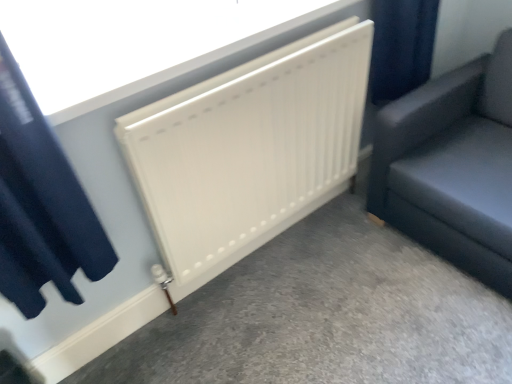
The width and height of the screenshot is (512, 384). What do you see at coordinates (249, 149) in the screenshot? I see `white matte radiator at center` at bounding box center [249, 149].

Where is `dark blue velvet curtain at upper left`? The height and width of the screenshot is (384, 512). dark blue velvet curtain at upper left is located at coordinates (41, 204).

Identify the location of matte black sofa at right. (452, 166).

From the image's perspective, which one is positioned higher, dark blue velvet curtain at upper left or white matte radiator at center?

white matte radiator at center, from the image's perspective.

Locate an element on the screen. The height and width of the screenshot is (384, 512). radiator behind the dark blue velvet curtain at upper left is located at coordinates (249, 149).

Which is behind, dark blue velvet curtain at upper left or white matte radiator at center?

white matte radiator at center.

From a real-world perspective, between dark blue velvet curtain at upper left and white matte radiator at center, who is vertically higher?

dark blue velvet curtain at upper left is physically above.

The width and height of the screenshot is (512, 384). Find the location of `furniture on the right of dark blue velvet curtain at upper left`. furniture on the right of dark blue velvet curtain at upper left is located at coordinates (452, 166).

Can you tell me how much dark blue velvet curtain at upper left and matte black sofa at right differ in facing direction?

There is a 90.7-degree angle between the facing directions of dark blue velvet curtain at upper left and matte black sofa at right.

Is dark blue velvet curtain at upper left oriented away from matte black sofa at right?

That's not correct — dark blue velvet curtain at upper left is not looking away from matte black sofa at right.

From the image's perspective, is dark blue velvet curtain at upper left on matte black sofa at right?

Incorrect, from the image's perspective, dark blue velvet curtain at upper left is lower than matte black sofa at right.

From a real-world perspective, is matte black sofa at right positioned under white matte radiator at center based on gravity?

Yes, from a real-world perspective, matte black sofa at right is under white matte radiator at center.

Is white matte radiator at center located within matte black sofa at right?

No, white matte radiator at center is located outside of matte black sofa at right.

What's the angular difference between matte black sofa at right and white matte radiator at center's facing directions?

matte black sofa at right and white matte radiator at center are facing 88.6 degrees away from each other.

Based on the photo, from the image's perspective, is matte black sofa at right on top of white matte radiator at center?

Yes, from the image's perspective, matte black sofa at right is over white matte radiator at center.

Is white matte radiator at center facing towards matte black sofa at right?

No, white matte radiator at center does not turn towards matte black sofa at right.

Can you tell me how much white matte radiator at center and matte black sofa at right differ in facing direction?

The angular difference between white matte radiator at center and matte black sofa at right is 90 degrees.

From the image's perspective, is white matte radiator at center above or below matte black sofa at right?

Based on their image positions, white matte radiator at center is located beneath matte black sofa at right.

Which is more distant, (324, 223) or (498, 126)?

The point (324, 223) is farther from the camera.

Would you consider matte black sofa at right to be distant from white matte radiator at center?

No, there isn't a large distance between matte black sofa at right and white matte radiator at center.

Locate an element on the screen. furniture located underneath the white matte radiator at center (from a real-world perspective) is located at coordinates (452, 166).

Does point (489, 273) come closer to viewer compared to point (41, 46)?

No.

In terms of size, does dark blue velvet curtain at upper left appear bigger or smaller than white matte radiator at center?

In the image, dark blue velvet curtain at upper left appears to be larger than white matte radiator at center.

Would you say dark blue velvet curtain at upper left is outside white matte radiator at center?

That's correct, dark blue velvet curtain at upper left is outside of white matte radiator at center.

Relative to white matte radiator at center, is dark blue velvet curtain at upper left in front or behind?

In the image, dark blue velvet curtain at upper left appears in front of white matte radiator at center.

At what (x,y) coordinates should I click in order to perform the action: click on furniture below the white matte radiator at center (from a real-world perspective). Please return your answer as a coordinate pair (x, y). Looking at the image, I should click on (452, 166).

Based on the photo, is white matte radiator at center positioned with its back to matte black sofa at right?

white matte radiator at center is not turned away from matte black sofa at right.

Is white matte radiator at center smaller than matte black sofa at right?

Correct, white matte radiator at center occupies less space than matte black sofa at right.

Considering the positions of objects white matte radiator at center and matte black sofa at right in the image provided, who is more to the left, white matte radiator at center or matte black sofa at right?

white matte radiator at center.

The image size is (512, 384). What are the coordinates of `radiator that appears behind the dark blue velvet curtain at upper left` in the screenshot? It's located at 249,149.

What are the coordinates of `furniture below the dark blue velvet curtain at upper left (from a real-world perspective)` in the screenshot? It's located at (452, 166).

Looking at the image, which one is located closer to dark blue velvet curtain at upper left, white matte radiator at center or matte black sofa at right?

white matte radiator at center is closer to dark blue velvet curtain at upper left.

Considering their positions, is matte black sofa at right positioned further to white matte radiator at center than white matte radiator at center?

white matte radiator at center is positioned further to the anchor white matte radiator at center.

Based on their spatial positions, is white matte radiator at center or matte black sofa at right closer to white matte radiator at center?

The object closer to white matte radiator at center is matte black sofa at right.

From the image, which object appears to be farther from white matte radiator at center, white matte radiator at center or dark blue velvet curtain at upper left?

dark blue velvet curtain at upper left lies further to white matte radiator at center than the other object.

Looking at the image, which one is located further to dark blue velvet curtain at upper left, white matte radiator at center or white matte radiator at center?

white matte radiator at center lies further to dark blue velvet curtain at upper left than the other object.

Estimate the real-world distances between objects in this image. Which object is closer to white matte radiator at center, dark blue velvet curtain at upper left or white matte radiator at center?

The object closer to white matte radiator at center is white matte radiator at center.

Which object lies further to the anchor point white matte radiator at center, white matte radiator at center or white matte radiator at center?

white matte radiator at center is positioned further to the anchor white matte radiator at center.

Based on their spatial positions, is matte black sofa at right or white matte radiator at center closer to white matte radiator at center?

Among the two, matte black sofa at right is located nearer to white matte radiator at center.

Where is `radiator between dark blue velvet curtain at upper left and white matte radiator at center from left to right`? radiator between dark blue velvet curtain at upper left and white matte radiator at center from left to right is located at coordinates (249, 149).

In order to click on concrete between white matte radiator at center and matte black sofa at right from left to right in this screenshot , I will do `click(324, 316)`.

You are a GUI agent. You are given a task and a screenshot of the screen. Output one action in this format:
    pyautogui.click(x=<x>, y=<y>)
    Task: Click on the curtain between white matte radiator at center and white matte radiator at center in the vertical direction
    This screenshot has width=512, height=384.
    Given the screenshot: What is the action you would take?
    pyautogui.click(x=41, y=204)

At what (x,y) coordinates should I click in order to perform the action: click on radiator between white matte radiator at center and matte black sofa at right. Please return your answer as a coordinate pair (x, y). The height and width of the screenshot is (384, 512). Looking at the image, I should click on (249, 149).